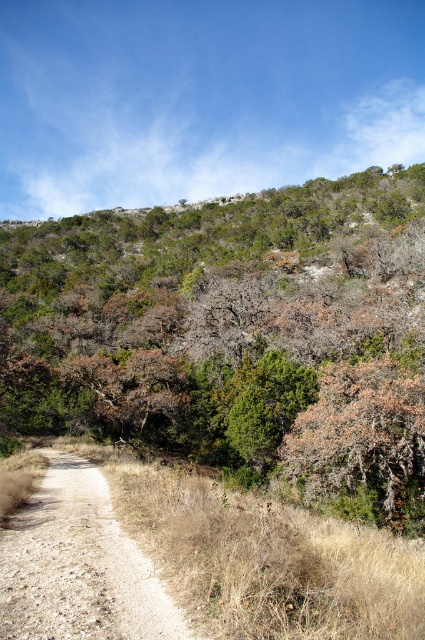
From the picture: You are standing at the bottom left corner of the dirt path in the forest. You want to walk towards the green leafy tree at center. Which direction should you head?

You should head diagonally towards the center of the frame, as the green leafy tree at center is located at point (235, 333), which is in the center area of the image.

You are a hiker standing at the point marked by the coordinates point (x=235, y=333), which is the green leafy tree at center. You want to walk towards the dense vegetation where the dirt path disappears. Which direction should you head?

The dirt path stretches diagonally from the bottom left corner towards the center of the frame, disappearing into the dense vegetation. Since you are at the green leafy tree at center, you should head towards the direction where the path disappears, which is into the dense vegetation at the center.